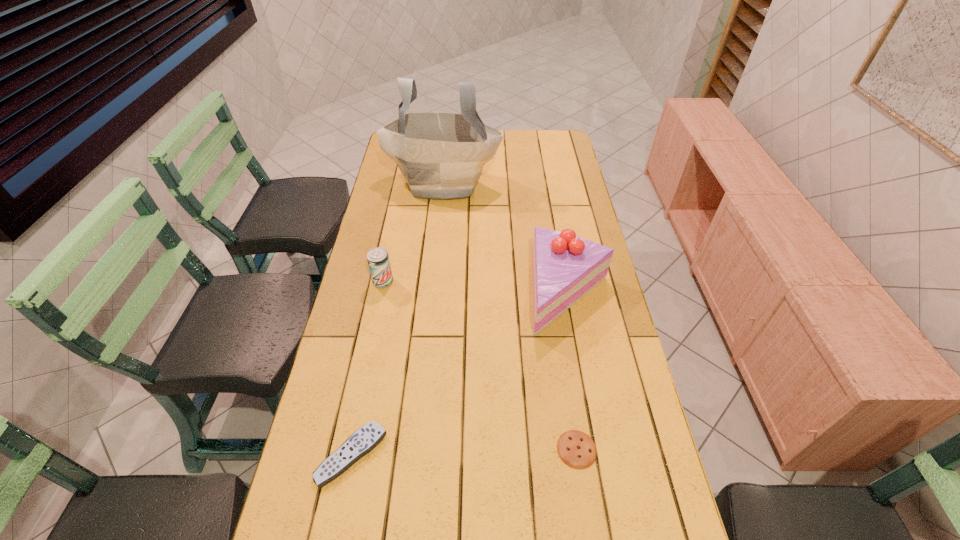
Locate an element on the screen. the tallest object is located at coordinates (441, 155).

Identify the location of shopping bag. (441, 155).

This screenshot has width=960, height=540. I want to click on the fourth shortest object, so click(x=565, y=267).

Where is `the third shortest object`? The width and height of the screenshot is (960, 540). the third shortest object is located at coordinates (378, 260).

The image size is (960, 540). I want to click on the second shortest object, so click(x=366, y=438).

Locate an element on the screen. cookie is located at coordinates (576, 449).

Find the location of a particular element. This screenshot has height=540, width=960. vacant space located 0.160m on the back of the shopping bag is located at coordinates (447, 146).

Locate an element on the screen. vacant space situated on the left of the second tallest object is located at coordinates (403, 293).

What are the coordinates of `free space located on the back of the third shortest object` in the screenshot? It's located at (392, 242).

Where is `vacant space located 0.230m on the right of the remote control`? This screenshot has width=960, height=540. vacant space located 0.230m on the right of the remote control is located at coordinates (483, 455).